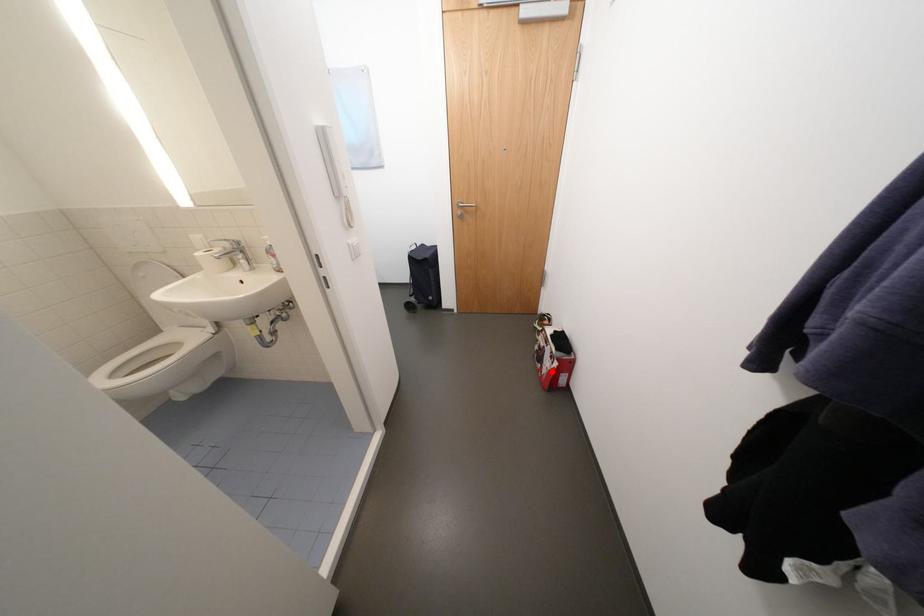
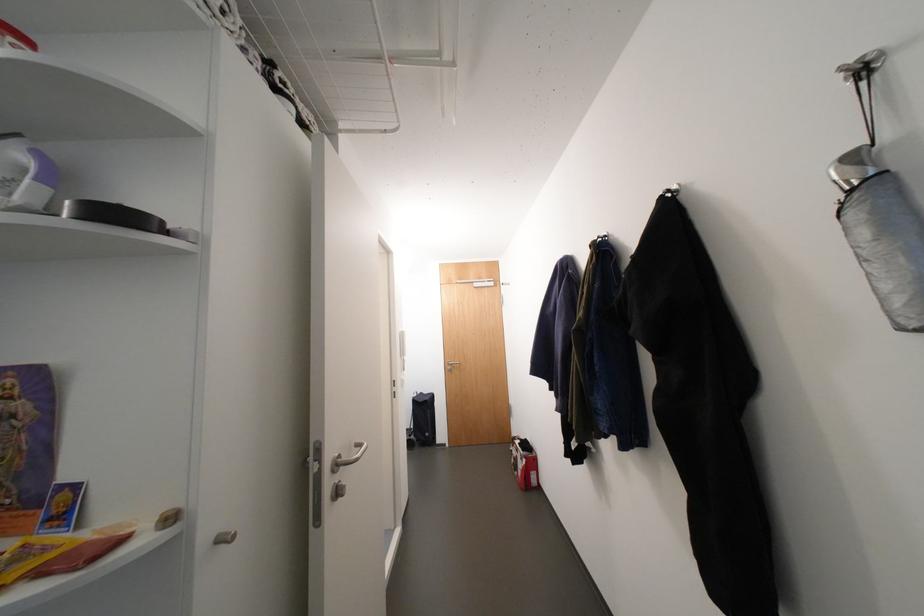
Find the pixel in the second image that matches the highlighted location in the first image.

(527, 474)